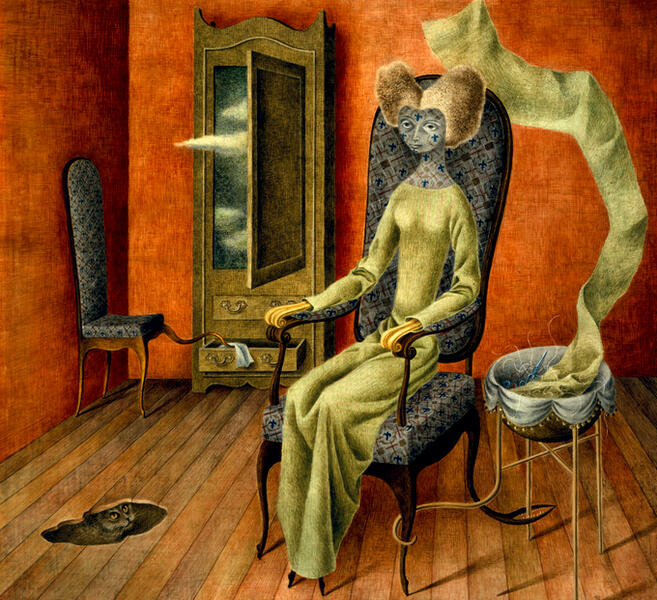
What are the coordinates of `painting` in the screenshot? It's located at (165, 419).